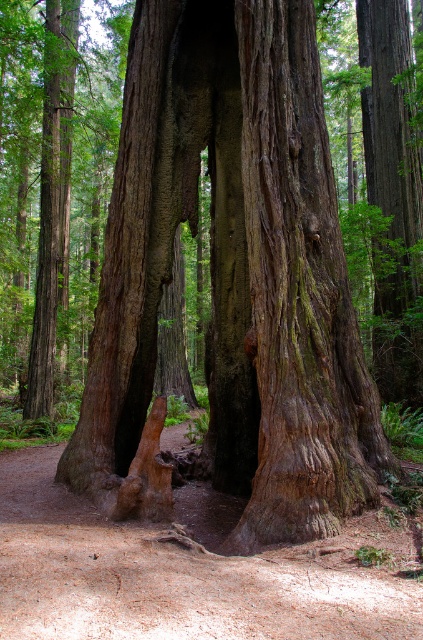
Is green mossy bark tree trunk at center thinner than smooth brown bark at center?

In fact, green mossy bark tree trunk at center might be wider than smooth brown bark at center.

At what (x,y) coordinates should I click in order to perform the action: click on green mossy bark tree trunk at center. Please return your answer as a coordinate pair (x, y). This screenshot has width=423, height=640. Looking at the image, I should click on (299, 296).

You are a GUI agent. You are given a task and a screenshot of the screen. Output one action in this format:
    pyautogui.click(x=<x>, y=<y>)
    Task: Click on the green mossy bark tree trunk at center
    The height and width of the screenshot is (640, 423).
    Given the screenshot: What is the action you would take?
    pyautogui.click(x=299, y=296)

Where is `brown dirt trail at center`? The width and height of the screenshot is (423, 640). brown dirt trail at center is located at coordinates (183, 576).

Where is `brown dirt trail at center`? The height and width of the screenshot is (640, 423). brown dirt trail at center is located at coordinates (183, 576).

Between green mossy bark tree trunk at center and brown dirt trail at center, which one appears on the right side from the viewer's perspective?

green mossy bark tree trunk at center is more to the right.

Is green mossy bark tree trunk at center to the left of brown dirt trail at center from the viewer's perspective?

No, green mossy bark tree trunk at center is not to the left of brown dirt trail at center.

This screenshot has height=640, width=423. What do you see at coordinates (299, 296) in the screenshot?
I see `green mossy bark tree trunk at center` at bounding box center [299, 296].

What are the coordinates of `green mossy bark tree trunk at center` in the screenshot? It's located at (299, 296).